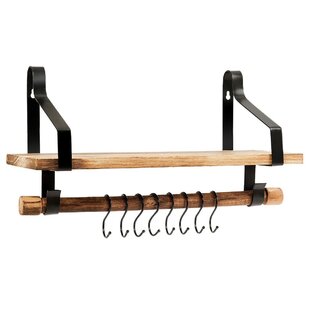
Where is `3rd black hook`? The image size is (310, 310). 3rd black hook is located at coordinates (135, 236).